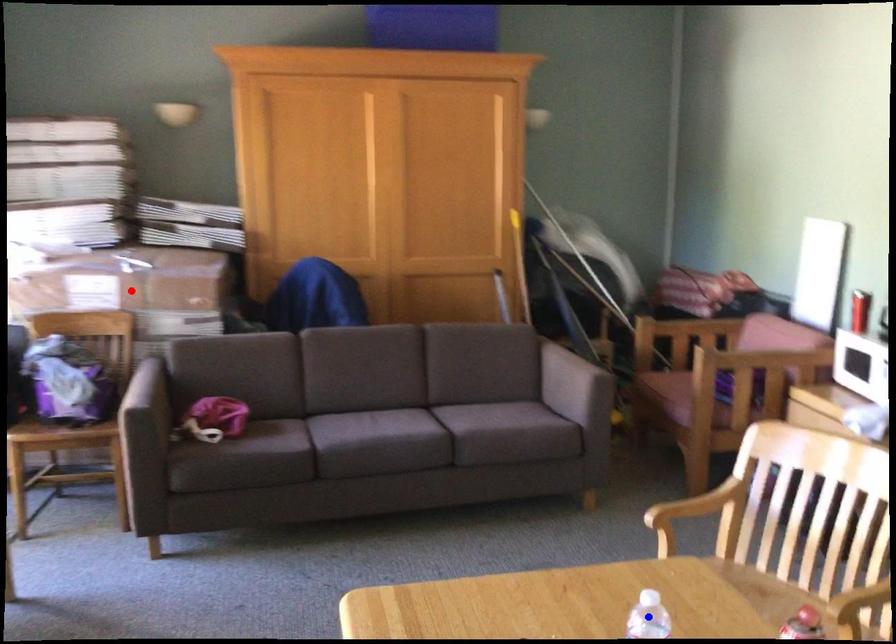
Question: Which of the two points in the image is closer to the camera?

Choices:
 (A) Blue point is closer.
 (B) Red point is closer.

Answer: (A)